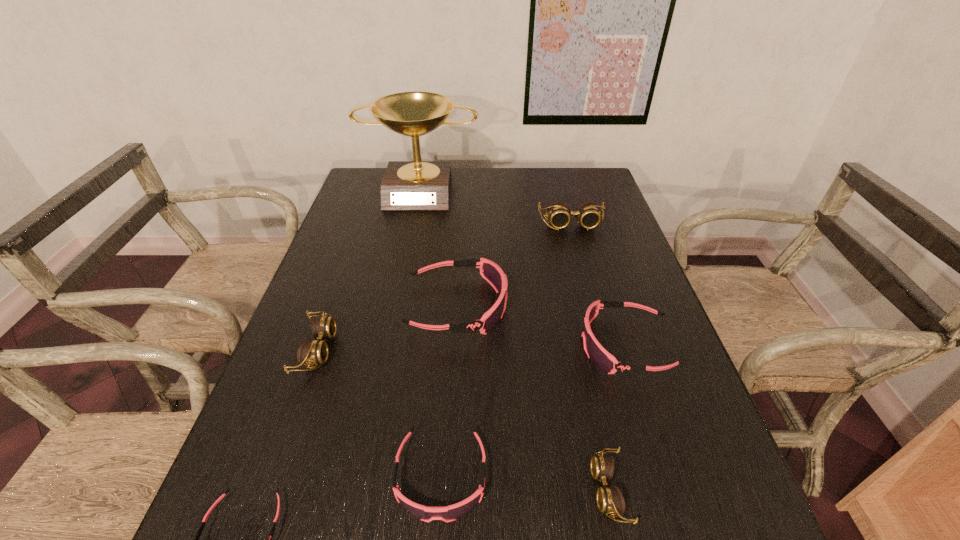
At what (x,y) coordinates should I click in order to perform the action: click on free spot located on the front-facing side of the tallest object. Please return your answer as a coordinate pair (x, y). Looking at the image, I should click on [408, 249].

Identify the location of vacant area situated on the front-facing side of the biggest pink goggles. Image resolution: width=960 pixels, height=540 pixels. (602, 306).

This screenshot has width=960, height=540. I want to click on vacant space situated 0.100m through the lenses of the second farthest object, so click(x=579, y=253).

This screenshot has width=960, height=540. Find the location of `blank space located on the front-facing side of the third smallest pink goggles`. blank space located on the front-facing side of the third smallest pink goggles is located at coordinates (541, 346).

The width and height of the screenshot is (960, 540). Identify the location of vacant space situated on the front-facing side of the third smallest pink goggles. (533, 346).

I want to click on free region located 0.380m on the front-facing side of the third smallest pink goggles, so click(416, 346).

You are a GUI agent. You are given a task and a screenshot of the screen. Output one action in this format:
    pyautogui.click(x=<x>, y=<y>)
    Task: Click on the free location located 0.280m through the lenses of the second nearest brown goggles
    
    Given the screenshot: What is the action you would take?
    pyautogui.click(x=455, y=349)

Find the location of `free spot located 0.300m through the lenses of the smallest brown goggles`. free spot located 0.300m through the lenses of the smallest brown goggles is located at coordinates [421, 490].

This screenshot has width=960, height=540. Find the location of `free space located 0.330m through the lenses of the smallest brown goggles`. free space located 0.330m through the lenses of the smallest brown goggles is located at coordinates (404, 490).

Find the location of a particular element. The image size is (960, 540). vacant region located 0.170m through the lenses of the smallest brown goggles is located at coordinates (496, 490).